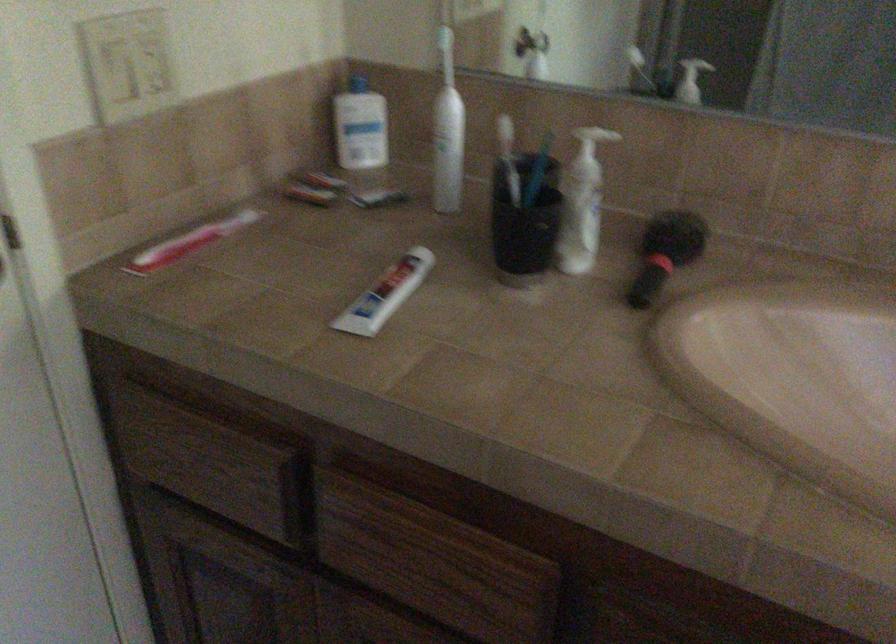
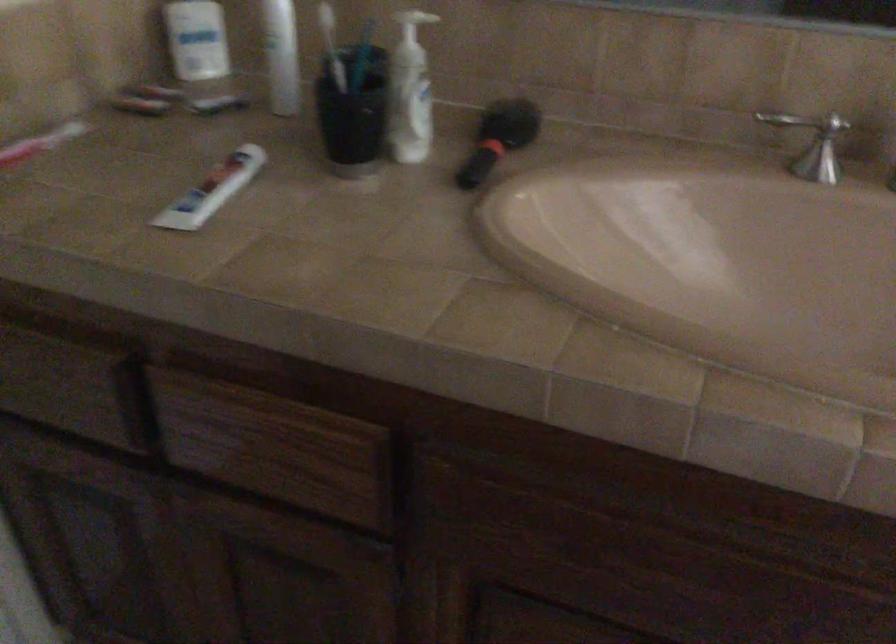
In the second image, find the point that corresponds to point 388,292 in the first image.

(211, 190)